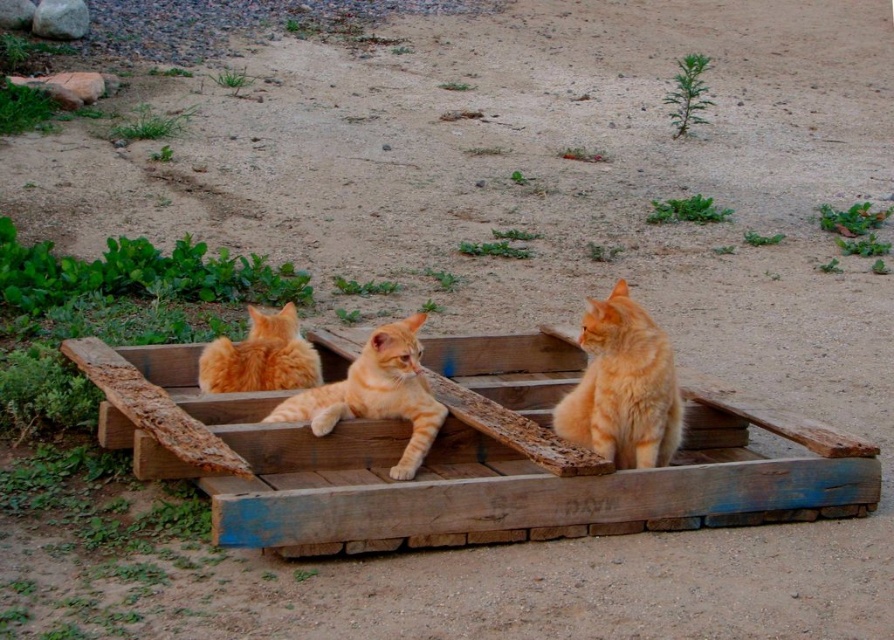
Question: Which object is farther from the camera taking this photo?

Choices:
 (A) orange fur cat at center
 (B) weathered wood crate at center
 (C) orange tabby cat at center

Answer: (A)

Question: Is orange fur cat at right below orange tabby cat at center?

Choices:
 (A) yes
 (B) no

Answer: (B)

Question: Is orange fur cat at right further to the viewer compared to orange tabby cat at center?

Choices:
 (A) no
 (B) yes

Answer: (A)

Question: Which object is farther from the camera taking this photo?

Choices:
 (A) weathered wood crate at center
 (B) orange fur cat at right
 (C) orange tabby cat at center

Answer: (C)

Question: Can you confirm if orange fur cat at right is positioned to the left of orange fur cat at center?

Choices:
 (A) no
 (B) yes

Answer: (A)

Question: Among these objects, which one is farthest from the camera?

Choices:
 (A) orange fur cat at right
 (B) orange tabby cat at center

Answer: (B)